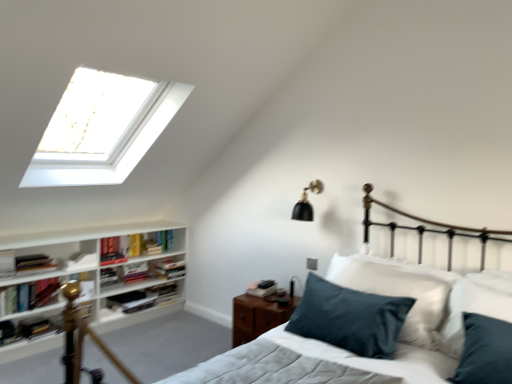
Question: Does hardcover book at left, arranged as the 8th book when ordered from the bottom, have a larger size compared to white paper at left, marked as the 3th book in a top-to-bottom arrangement?

Choices:
 (A) no
 (B) yes

Answer: (B)

Question: Is hardcover book at left, marked as the 2th book in a top-to-bottom arrangement, further to camera compared to white paper at left, which is the seventh book in bottom-to-top order?

Choices:
 (A) yes
 (B) no

Answer: (B)

Question: Could you tell me if hardcover book at left, marked as the 2th book in a top-to-bottom arrangement, is facing white paper at left, which is the seventh book in bottom-to-top order?

Choices:
 (A) yes
 (B) no

Answer: (B)

Question: From a real-world perspective, does hardcover book at left, arranged as the 8th book when ordered from the bottom, sit lower than white paper at left, marked as the 3th book in a top-to-bottom arrangement?

Choices:
 (A) no
 (B) yes

Answer: (A)

Question: Is white paper at left, marked as the 3th book in a top-to-bottom arrangement, completely or partially inside hardcover book at left, marked as the 2th book in a top-to-bottom arrangement?

Choices:
 (A) no
 (B) yes

Answer: (A)

Question: Does hardcover book at left, marked as the 2th book in a top-to-bottom arrangement, have a greater width compared to white paper at left, which is the seventh book in bottom-to-top order?

Choices:
 (A) yes
 (B) no

Answer: (A)

Question: Is hardcover book at left, marked as the 2th book in a top-to-bottom arrangement, next to hardcover book at center-left, the fourth book when ordered from top to bottom, and touching it?

Choices:
 (A) no
 (B) yes

Answer: (A)

Question: Can you confirm if hardcover book at left, arranged as the 8th book when ordered from the bottom, is taller than hardcover book at center-left, which is counted as the sixth book, starting from the bottom?

Choices:
 (A) yes
 (B) no

Answer: (B)

Question: From the image's perspective, is hardcover book at left, arranged as the 8th book when ordered from the bottom, above hardcover book at center-left, the fourth book when ordered from top to bottom?

Choices:
 (A) no
 (B) yes

Answer: (B)

Question: Does hardcover book at left, arranged as the 8th book when ordered from the bottom, have a smaller size compared to hardcover book at center-left, the fourth book when ordered from top to bottom?

Choices:
 (A) no
 (B) yes

Answer: (B)

Question: Does hardcover book at left, arranged as the 8th book when ordered from the bottom, appear on the left side of hardcover book at center-left, which is counted as the sixth book, starting from the bottom?

Choices:
 (A) yes
 (B) no

Answer: (A)

Question: From a real-world perspective, is hardcover book at left, marked as the 2th book in a top-to-bottom arrangement, over hardcover book at center-left, which is counted as the sixth book, starting from the bottom?

Choices:
 (A) yes
 (B) no

Answer: (A)

Question: Is the depth of black matte wall sconce at upper right less than that of hardcover book at left, which is counted as the first book, starting from the bottom?

Choices:
 (A) no
 (B) yes

Answer: (B)